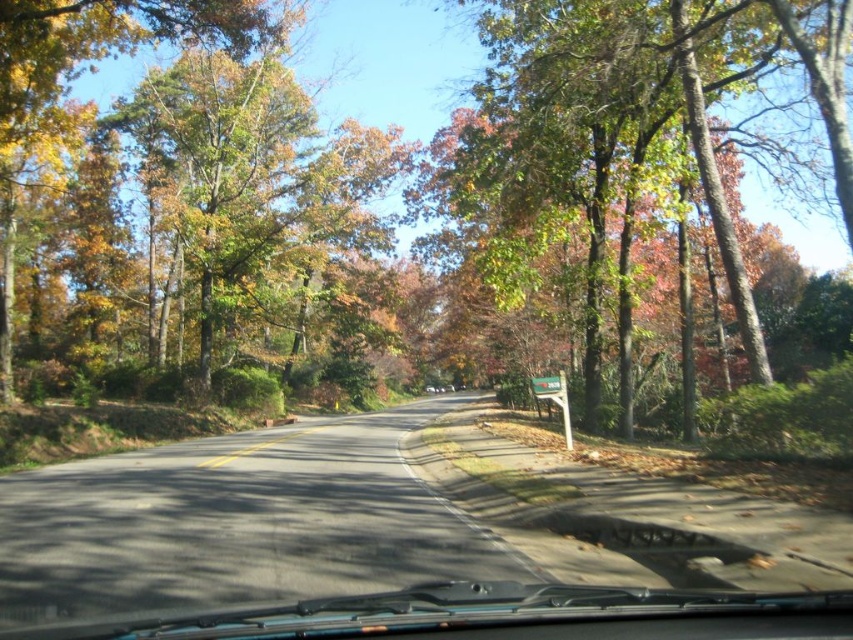
Question: Is transparent rubber windshield wipers at lower center to the right of green plastic sign at center from the viewer's perspective?

Choices:
 (A) yes
 (B) no

Answer: (B)

Question: Which point is farther to the camera?

Choices:
 (A) (527, 176)
 (B) (727, 618)

Answer: (A)

Question: Can you confirm if green leafy tree at center is positioned below green plastic sign at center?

Choices:
 (A) no
 (B) yes

Answer: (A)

Question: Does green leafy tree at center appear over green plastic sign at center?

Choices:
 (A) no
 (B) yes

Answer: (B)

Question: Which point is closer to the camera?

Choices:
 (A) transparent rubber windshield wipers at lower center
 (B) green leafy tree at center
 (C) green plastic sign at center

Answer: (A)

Question: Which of the following is the closest to the observer?

Choices:
 (A) (79, 632)
 (B) (535, 394)

Answer: (A)